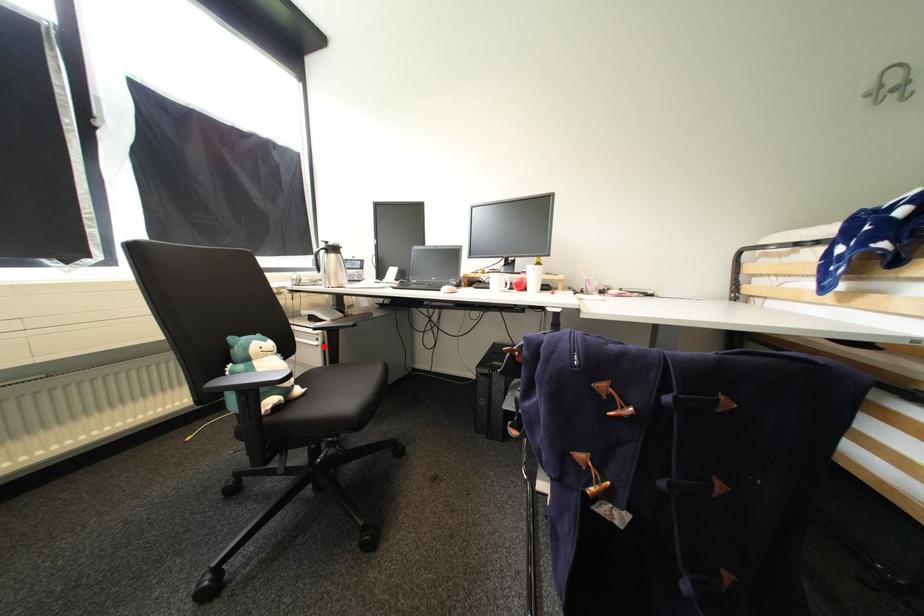
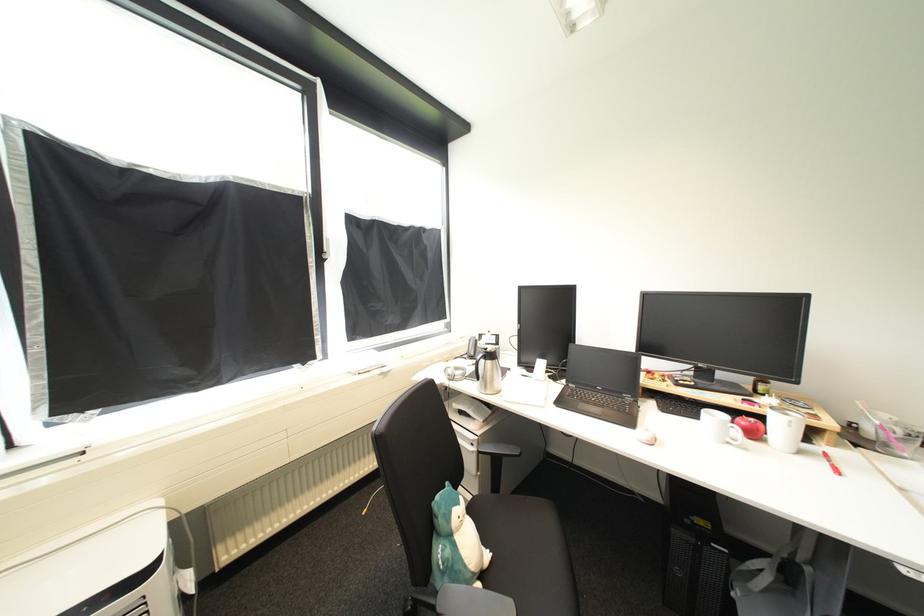
Locate, in the second image, the point that corresponds to the highlighted location in the first image.

(480, 453)